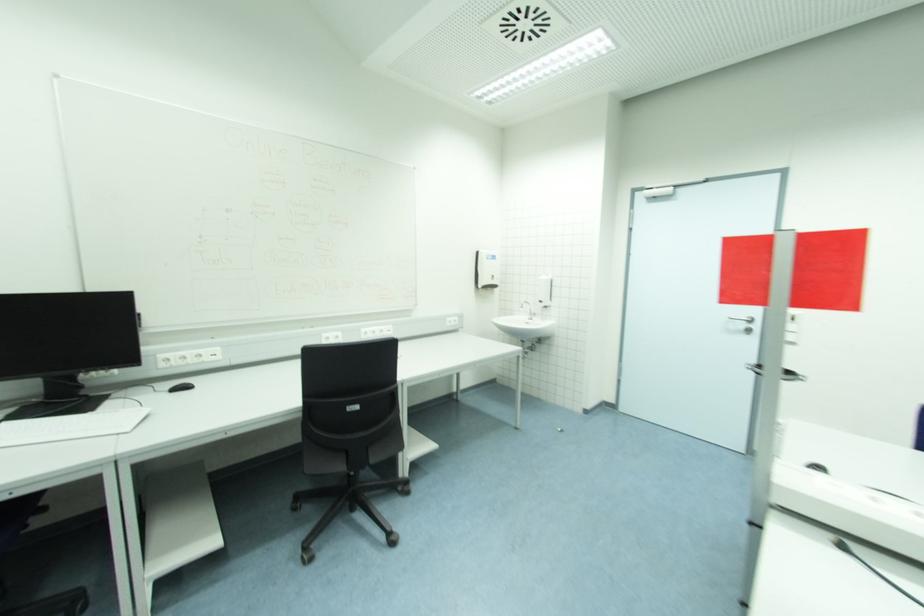
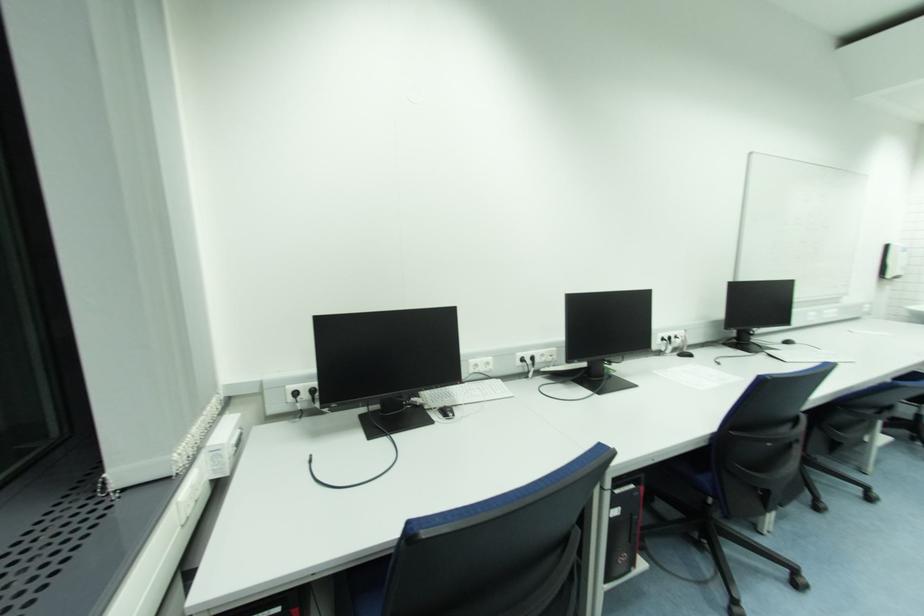
Find the pixel in the second image that matches point (480, 254) in the first image.

(892, 248)